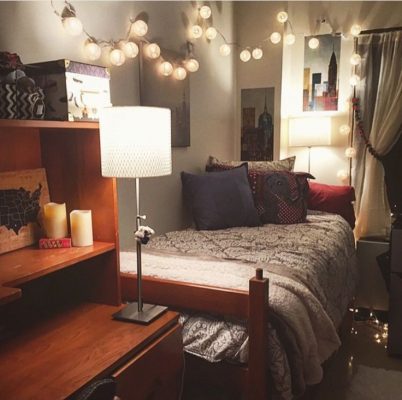
Image resolution: width=402 pixels, height=400 pixels. What are the coordinates of `box` in the screenshot? It's located at (73, 84).